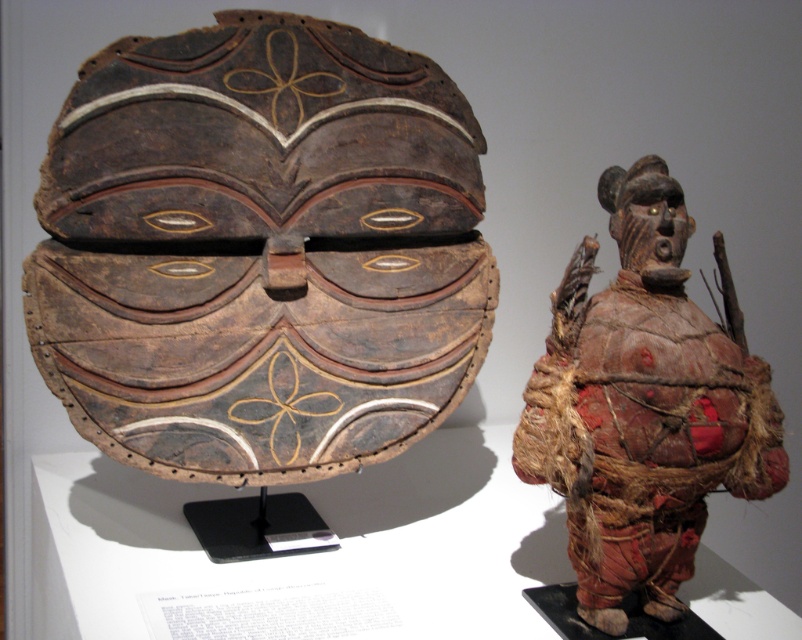
Question: Which of the following is the closest to the observer?

Choices:
 (A) (641, 316)
 (B) (294, 227)

Answer: (A)

Question: Where is brown carved wood helmet at upper left located in relation to brown textured cloth warrior at right in the image?

Choices:
 (A) left
 (B) right

Answer: (A)

Question: Does brown carved wood helmet at upper left come behind brown textured cloth warrior at right?

Choices:
 (A) yes
 (B) no

Answer: (A)

Question: In this image, where is brown carved wood helmet at upper left located relative to brown textured cloth warrior at right?

Choices:
 (A) above
 (B) below

Answer: (A)